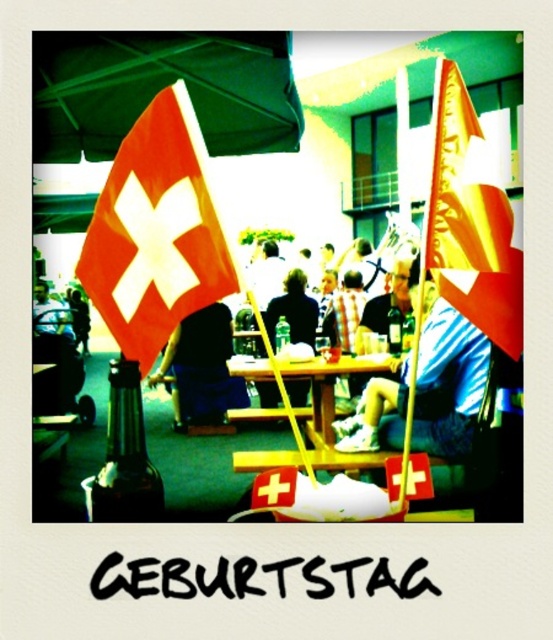
Does blue striped shirt at center have a lesser width compared to dark blue fabric at center?

Yes, blue striped shirt at center is thinner than dark blue fabric at center.

Is point (430, 380) more distant than point (217, 388)?

No.

Is point (437, 381) positioned after point (204, 349)?

No, it is not.

Identify the location of blue striped shirt at center. The height and width of the screenshot is (640, 553). (448, 381).

Can you confirm if orange fabric flag at center is thinner than dark blue shirt at center?

Yes, orange fabric flag at center is thinner than dark blue shirt at center.

Who is positioned more to the right, orange fabric flag at center or dark blue shirt at center?

Positioned to the right is dark blue shirt at center.

Locate an element on the screen. This screenshot has width=553, height=640. orange fabric flag at center is located at coordinates (156, 232).

Where is `orange fabric flag at center`? This screenshot has height=640, width=553. orange fabric flag at center is located at coordinates (156, 232).

Which of these two, orange fabric flag at center or blue striped shirt at center, stands shorter?

orange fabric flag at center

Is point (140, 186) farther from camera compared to point (429, 413)?

No, (140, 186) is in front of (429, 413).

The width and height of the screenshot is (553, 640). I want to click on orange fabric flag at center, so click(156, 232).